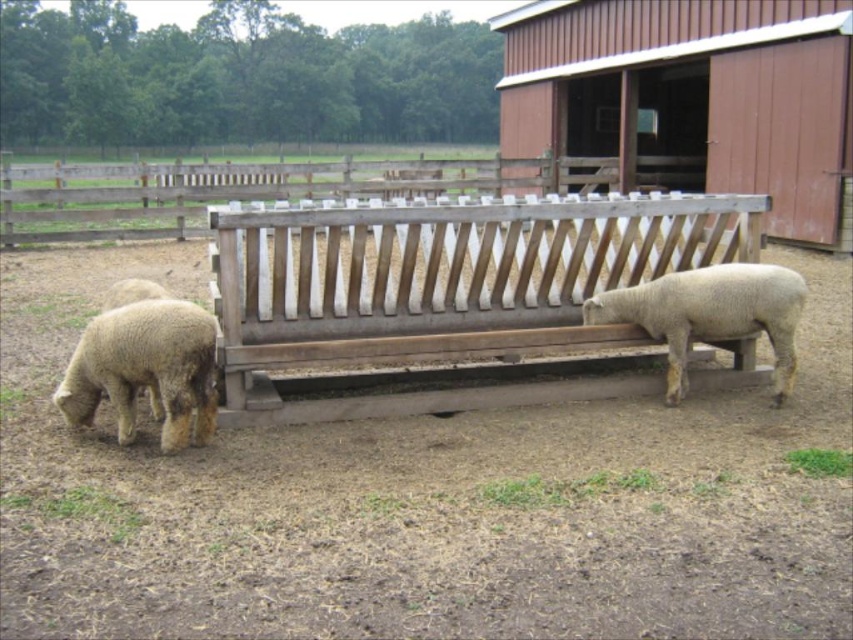
Question: Can you confirm if green leafy grass at lower right is positioned to the left of white woolen sheep at left?

Choices:
 (A) yes
 (B) no

Answer: (B)

Question: Considering the real-world distances, which object is closest to the white woolen sheep at right?

Choices:
 (A) weathered wood bench at center
 (B) white woolen sheep at left
 (C) green leafy grass at lower right

Answer: (A)

Question: Which of the following is the closest to the observer?

Choices:
 (A) (685, 387)
 (B) (115, 298)
 (C) (515, 211)

Answer: (C)

Question: Does white woolen sheep at lower left have a lesser width compared to white woolen sheep at right?

Choices:
 (A) yes
 (B) no

Answer: (A)

Question: Can you confirm if white woolen sheep at right is thinner than white woolen sheep at left?

Choices:
 (A) no
 (B) yes

Answer: (A)

Question: Which point is farther from the camera taking this photo?

Choices:
 (A) (68, 387)
 (B) (343, 308)
 (C) (682, 362)
 (D) (808, 464)

Answer: (B)